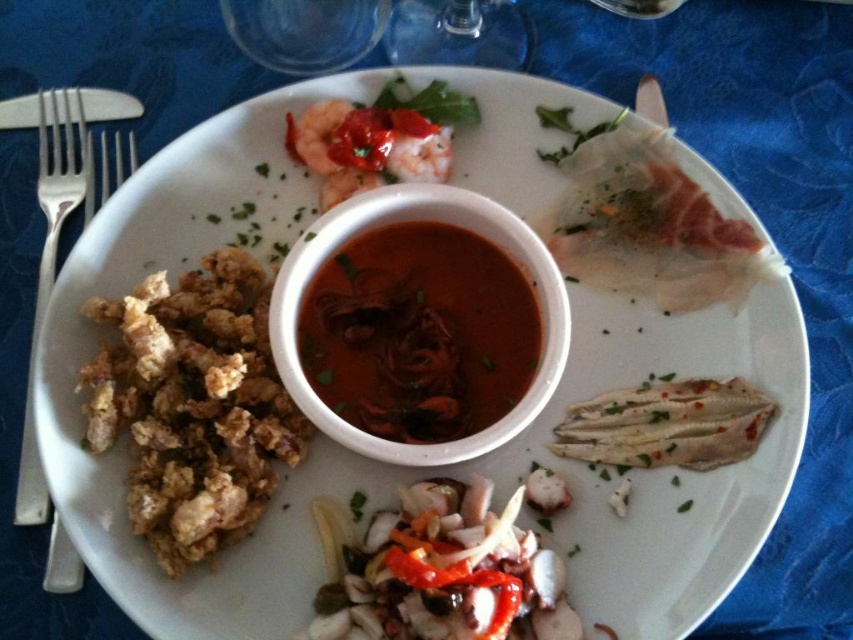
Question: Which point is farther to the camera?

Choices:
 (A) white flaky fish at lower right
 (B) brown crispy fried food at left

Answer: (A)

Question: Which object is closer to the camera taking this photo?

Choices:
 (A) dark red glossy sauce at center
 (B) white flaky fish at lower right

Answer: (B)

Question: Does brown crispy fried food at left have a larger size compared to slightly translucent squid at center?

Choices:
 (A) yes
 (B) no

Answer: (A)

Question: Can you confirm if brown crispy fried food at left is thinner than white flaky fish at lower right?

Choices:
 (A) no
 (B) yes

Answer: (A)

Question: Can you confirm if brown crispy fried food at left is positioned below white flaky fish at lower right?

Choices:
 (A) no
 (B) yes

Answer: (A)

Question: Which object is farther from the camera taking this photo?

Choices:
 (A) silver metallic fork at left
 (B) dark red glossy sauce at center

Answer: (A)